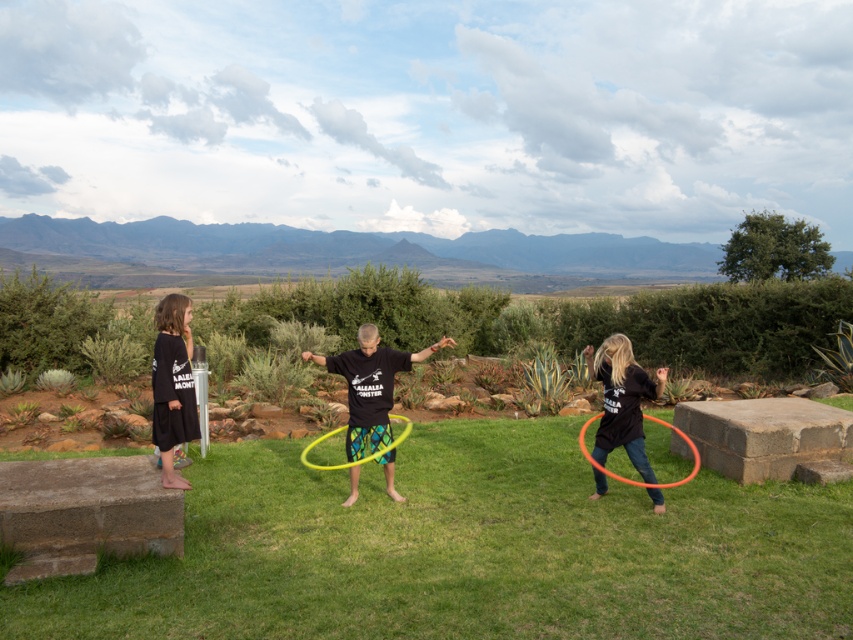
Does matte black t-shirt at center have a lesser width compared to black cotton shirt at left?

No.

Which is in front, point (447, 339) or point (164, 348)?

Point (164, 348)

Where is `matte black t-shirt at center`? The image size is (853, 640). matte black t-shirt at center is located at coordinates (370, 385).

Is the position of orange plastic hula hoop at lower right less distant than that of yellow plastic hula hoop at center?

Yes, orange plastic hula hoop at lower right is closer to the viewer.

Is point (695, 458) less distant than point (306, 460)?

Yes, point (695, 458) is in front of point (306, 460).

The image size is (853, 640). In order to click on orange plastic hula hoop at lower right in this screenshot , I will do `click(645, 481)`.

Who is taller, matte black t-shirt at center or black matte hula hoop at lower right?

matte black t-shirt at center is taller.

Between matte black t-shirt at center and black matte hula hoop at lower right, which one appears on the right side from the viewer's perspective?

From the viewer's perspective, black matte hula hoop at lower right appears more on the right side.

Does point (373, 403) come farther from viewer compared to point (608, 442)?

Yes.

What are the coordinates of `matte black t-shirt at center` in the screenshot? It's located at (370, 385).